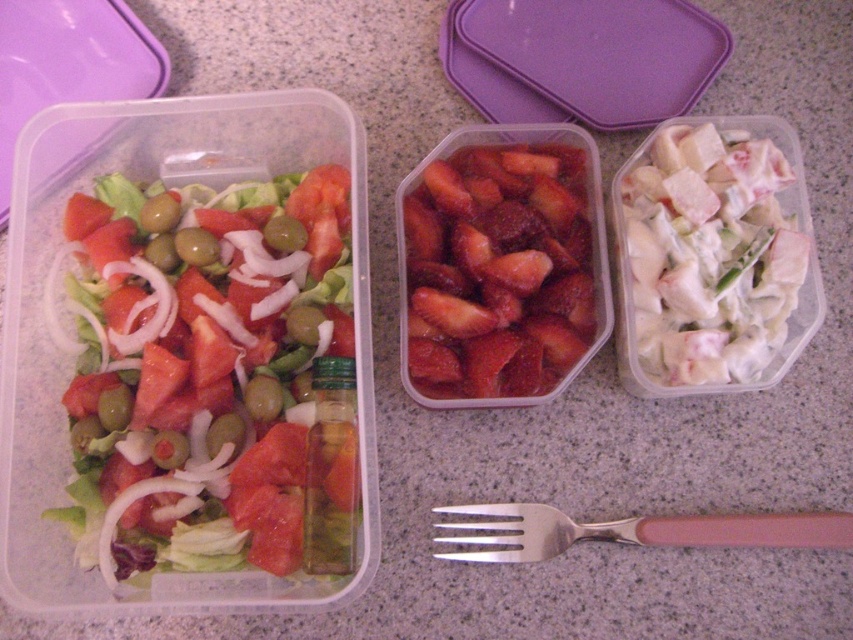
You are packing a lunchbox and need to place the white creamy chicken salad at right and the shiny red strawberries at center into a larger container. The new container has a divider that separates it into two sections. Which section should each item go into to maintain their original positions relative to each other?

The white creamy chicken salad at right should be placed in the right section and the shiny red strawberries at center in the left section to maintain their original positions since the white creamy chicken salad at right is to the right of the shiny red strawberries at center.

Consider the image. You are organizing a picnic and need to place the fresh green salad at left in your basket. Where exactly should you look for it in the image?

The fresh green salad at left is located at point [212,376] in the image.

You are arranging a picnic basket and need to place the fresh green salad at left and the silver metallic fork at center. According to the image, which item is located more to the left?

The fresh green salad at left is positioned more to the left than the silver metallic fork at center.